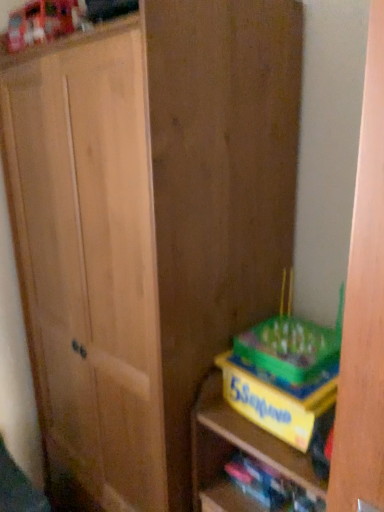
Question: Does yellow cardboard game box at lower right have a lesser height compared to yellow cardboard game at lower right?

Choices:
 (A) no
 (B) yes

Answer: (B)

Question: Is yellow cardboard game box at lower right closer to the viewer compared to yellow cardboard game at lower right?

Choices:
 (A) yes
 (B) no

Answer: (B)

Question: Does yellow cardboard game box at lower right come behind yellow cardboard game at lower right?

Choices:
 (A) yes
 (B) no

Answer: (A)

Question: Are yellow cardboard game box at lower right and yellow cardboard game at lower right far apart?

Choices:
 (A) no
 (B) yes

Answer: (A)

Question: Is yellow cardboard game box at lower right thinner than yellow cardboard game at lower right?

Choices:
 (A) yes
 (B) no

Answer: (A)

Question: From the image's perspective, is yellow cardboard game box at lower right over yellow cardboard game at lower right?

Choices:
 (A) yes
 (B) no

Answer: (A)

Question: Is yellow cardboard game box at lower right looking in the opposite direction of yellow cardboard book at lower right?

Choices:
 (A) no
 (B) yes

Answer: (A)

Question: Can you confirm if yellow cardboard game box at lower right is thinner than yellow cardboard book at lower right?

Choices:
 (A) yes
 (B) no

Answer: (B)

Question: Is yellow cardboard game box at lower right taller than yellow cardboard book at lower right?

Choices:
 (A) yes
 (B) no

Answer: (A)

Question: Is yellow cardboard game box at lower right smaller than yellow cardboard book at lower right?

Choices:
 (A) no
 (B) yes

Answer: (A)

Question: Is yellow cardboard game box at lower right wider than yellow cardboard book at lower right?

Choices:
 (A) no
 (B) yes

Answer: (B)

Question: Considering the relative sizes of yellow cardboard game box at lower right and yellow cardboard book at lower right in the image provided, is yellow cardboard game box at lower right bigger than yellow cardboard book at lower right?

Choices:
 (A) yes
 (B) no

Answer: (A)

Question: Considering the relative sizes of yellow cardboard book at lower right and yellow cardboard game at lower right in the image provided, is yellow cardboard book at lower right smaller than yellow cardboard game at lower right?

Choices:
 (A) yes
 (B) no

Answer: (A)